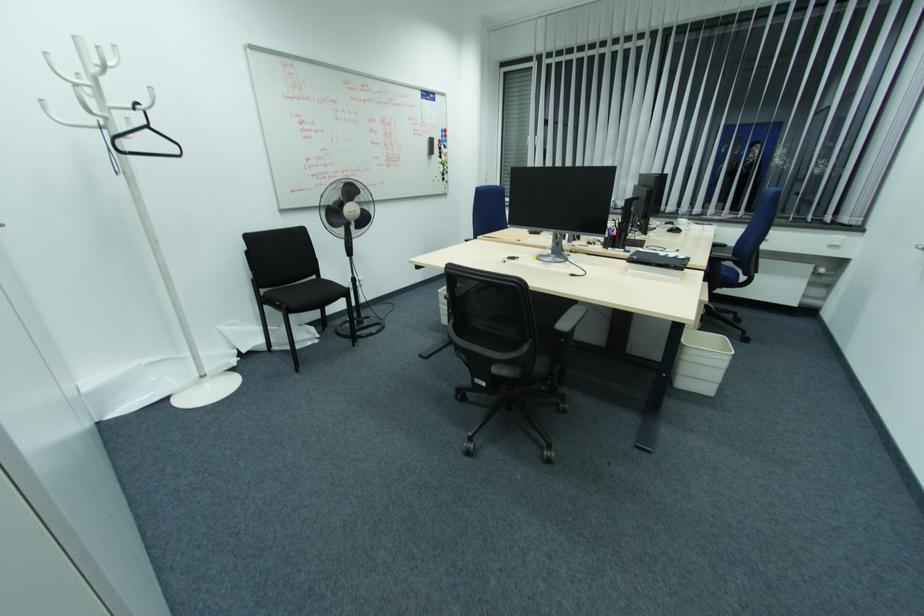
The image size is (924, 616). What do you see at coordinates (435, 148) in the screenshot?
I see `a magnetic whiteboard eraser` at bounding box center [435, 148].